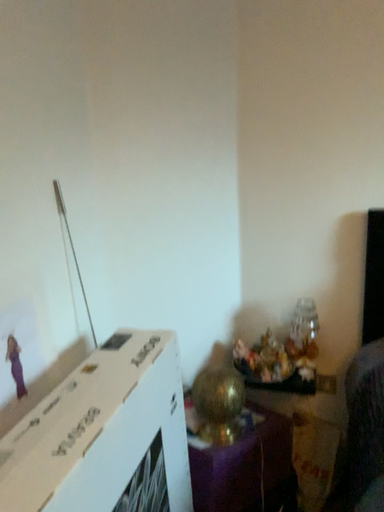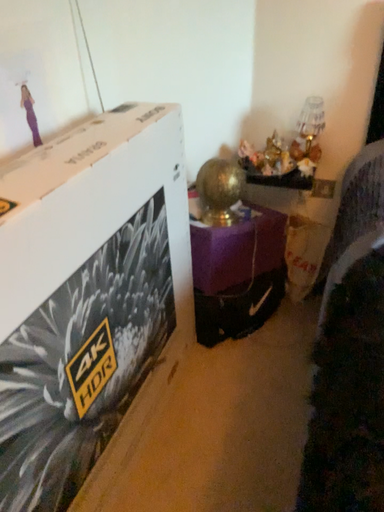
Question: Which way did the camera rotate in the video?

Choices:
 (A) rotated upward
 (B) rotated downward

Answer: (B)